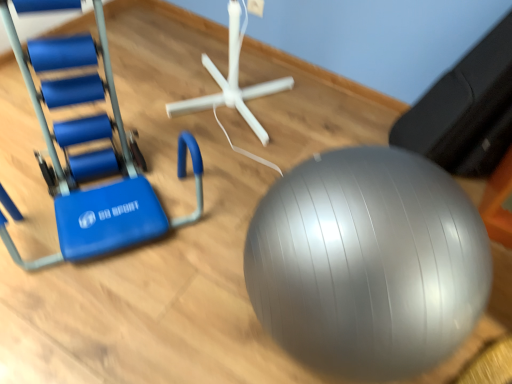
Question: Is blue rubber swivel chair at left wider than silver rubber ball at center?

Choices:
 (A) yes
 (B) no

Answer: (B)

Question: Is blue rubber swivel chair at left far from silver rubber ball at center?

Choices:
 (A) yes
 (B) no

Answer: (B)

Question: From a real-world perspective, is blue rubber swivel chair at left physically below silver rubber ball at center?

Choices:
 (A) no
 (B) yes

Answer: (A)

Question: Is blue rubber swivel chair at left thinner than silver rubber ball at center?

Choices:
 (A) yes
 (B) no

Answer: (A)

Question: Can you confirm if blue rubber swivel chair at left is smaller than silver rubber ball at center?

Choices:
 (A) yes
 (B) no

Answer: (B)

Question: Can you confirm if blue rubber swivel chair at left is shorter than silver rubber ball at center?

Choices:
 (A) no
 (B) yes

Answer: (A)

Question: Is silver rubber ball at center thinner than blue rubber swivel chair at left?

Choices:
 (A) no
 (B) yes

Answer: (A)

Question: Is the surface of silver rubber ball at center in direct contact with blue rubber swivel chair at left?

Choices:
 (A) no
 (B) yes

Answer: (A)

Question: From a real-world perspective, does silver rubber ball at center stand above blue rubber swivel chair at left?

Choices:
 (A) yes
 (B) no

Answer: (B)

Question: Is silver rubber ball at center positioned beyond the bounds of blue rubber swivel chair at left?

Choices:
 (A) no
 (B) yes

Answer: (B)

Question: Is silver rubber ball at center shorter than blue rubber swivel chair at left?

Choices:
 (A) no
 (B) yes

Answer: (B)

Question: Is silver rubber ball at center facing towards blue rubber swivel chair at left?

Choices:
 (A) no
 (B) yes

Answer: (A)

Question: Based on their positions, is silver rubber ball at center located to the left or right of blue rubber swivel chair at left?

Choices:
 (A) left
 (B) right

Answer: (B)